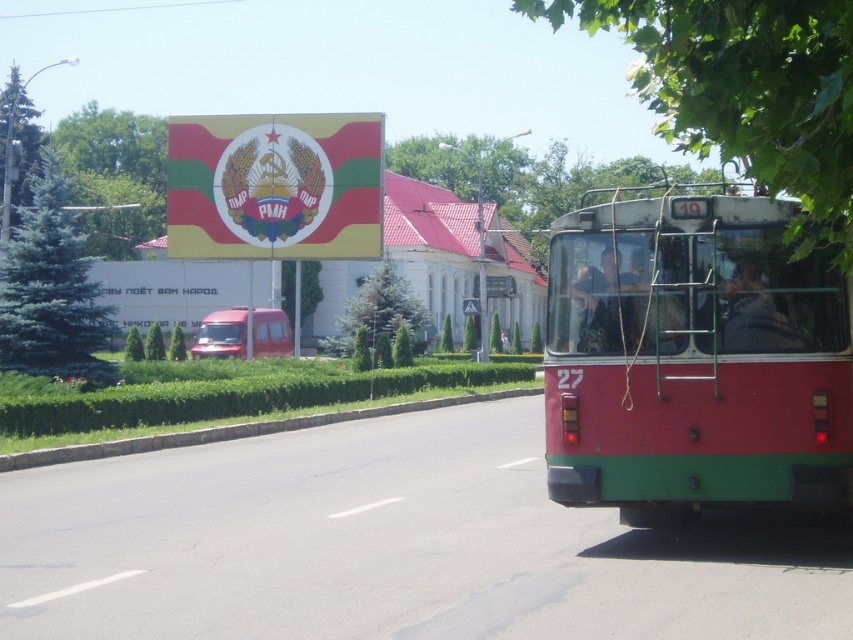
You are a delivery person who needs to park your 2.5 meters tall truck behind the matte red bus at right and the metallic red van at center. Can your truck fit vertically between them?

The matte red bus at right is taller than the metallic red van at center. Since the truck is 2.5 meters tall, and the van is shorter than the bus, the truck may not fit if the van is only 2.4 meters tall. However, without knowing the exact height of the van, it is uncertain. Please check the actual height of the metallic red van at center before deciding.

You are a pedestrian standing at the camera position. You want to cross the street to the park on the other side. The safe distance to cross is 8 meters. Can you safely cross the street before the matte red bus at right arrives?

The matte red bus at right is 8.30 meters away from camera. Since the safe distance to cross is 8 meters, the pedestrian cannot safely cross before the matte red bus at right arrives as the bus is closer than the safe distance.